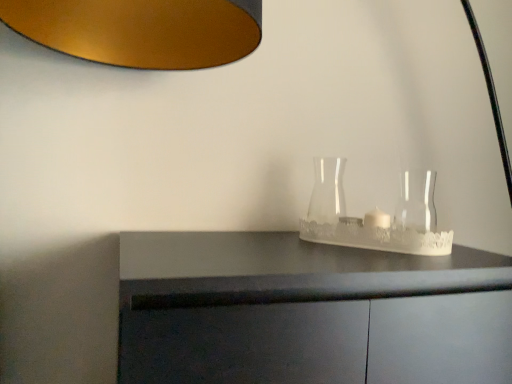
Question: From a real-world perspective, is transparent glass vase at right, the second glass vase viewed from the left, located beneath transparent glass vase at center, the second glass vase positioned from the right?

Choices:
 (A) yes
 (B) no

Answer: (A)

Question: Considering the relative sizes of transparent glass vase at right, the second glass vase viewed from the left, and transparent glass vase at center, the second glass vase positioned from the right, in the image provided, is transparent glass vase at right, the second glass vase viewed from the left, thinner than transparent glass vase at center, the second glass vase positioned from the right,?

Choices:
 (A) yes
 (B) no

Answer: (A)

Question: Is transparent glass vase at right, which is counted as the first glass vase, starting from the right, far from transparent glass vase at center, placed as the 1th glass vase when sorted from left to right?

Choices:
 (A) yes
 (B) no

Answer: (B)

Question: Is transparent glass vase at right, which is counted as the first glass vase, starting from the right, with transparent glass vase at center, the second glass vase positioned from the right?

Choices:
 (A) yes
 (B) no

Answer: (B)

Question: Is transparent glass vase at right, which is counted as the first glass vase, starting from the right, bigger than transparent glass vase at center, placed as the 1th glass vase when sorted from left to right?

Choices:
 (A) no
 (B) yes

Answer: (A)

Question: Is transparent glass vase at center, the second glass vase positioned from the right, inside transparent glass vase at right, which is counted as the first glass vase, starting from the right?

Choices:
 (A) yes
 (B) no

Answer: (B)

Question: Does transparent glass vase at center, the second glass vase positioned from the right, have a greater height compared to transparent glass vase at right, which is counted as the first glass vase, starting from the right?

Choices:
 (A) yes
 (B) no

Answer: (A)

Question: Could you tell me if transparent glass vase at center, the second glass vase positioned from the right, is turned towards transparent glass vase at right, the second glass vase viewed from the left?

Choices:
 (A) yes
 (B) no

Answer: (B)

Question: Considering the relative positions of transparent glass vase at center, the second glass vase positioned from the right, and transparent glass vase at right, the second glass vase viewed from the left, in the image provided, is transparent glass vase at center, the second glass vase positioned from the right, to the left of transparent glass vase at right, the second glass vase viewed from the left, from the viewer's perspective?

Choices:
 (A) no
 (B) yes

Answer: (B)

Question: Is transparent glass vase at right, the second glass vase viewed from the left, a part of transparent glass vase at center, placed as the 1th glass vase when sorted from left to right?

Choices:
 (A) yes
 (B) no

Answer: (B)

Question: From the image's perspective, is transparent glass vase at center, placed as the 1th glass vase when sorted from left to right, located above transparent glass vase at right, which is counted as the first glass vase, starting from the right?

Choices:
 (A) no
 (B) yes

Answer: (B)

Question: Are transparent glass vase at center, the second glass vase positioned from the right, and transparent glass vase at right, the second glass vase viewed from the left, making contact?

Choices:
 (A) yes
 (B) no

Answer: (B)

Question: Is transparent glass vase at center, placed as the 1th glass vase when sorted from left to right, bigger or smaller than transparent glass vase at right, which is counted as the first glass vase, starting from the right?

Choices:
 (A) big
 (B) small

Answer: (A)